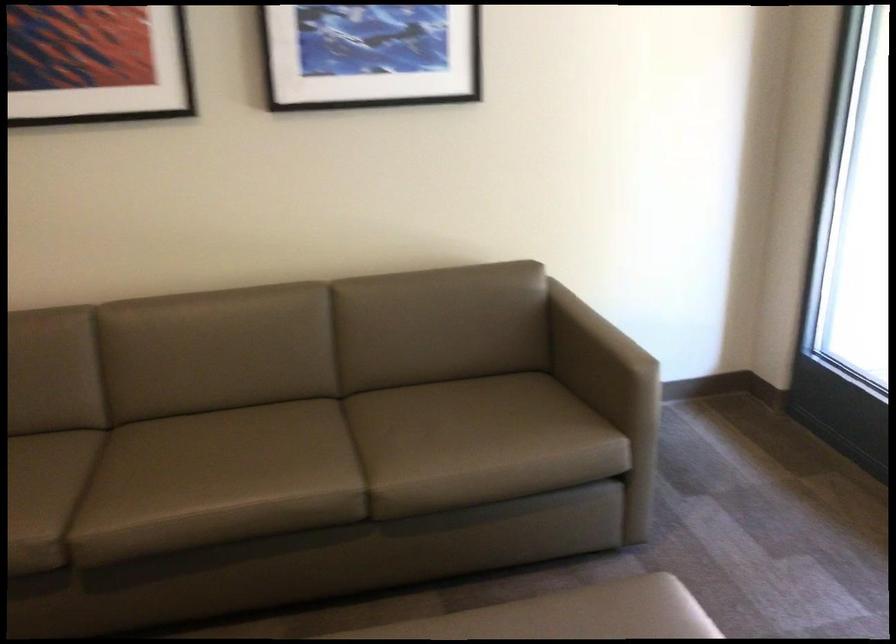
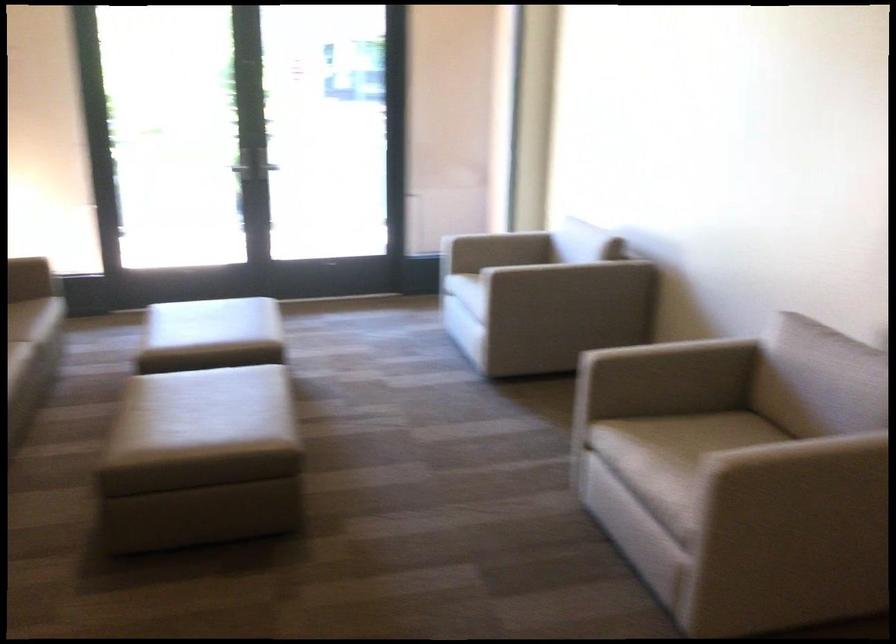
In the second image, find the point that corresponds to pixel 597 618 in the first image.

(150, 305)